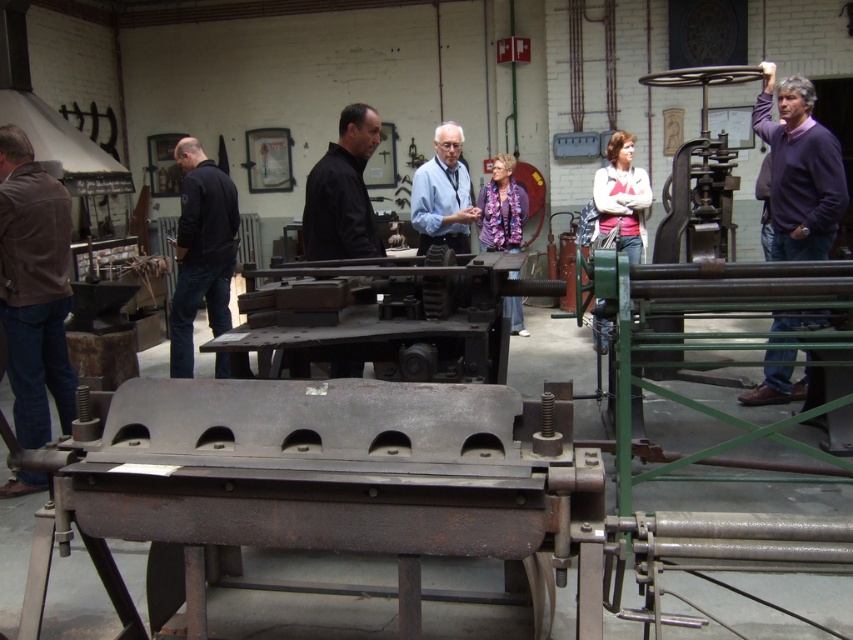
You are standing in the workshop and want to locate the brown leather jacket at left. Which direction should you move relative to the rusty metal machinery at center?

To locate the brown leather jacket at left, you should move to the left of the rusty metal machinery at center since the brown leather jacket at left is positioned to the left of the rusty metal machinery at center.

You are standing in the workshop and want to locate the rusty metal machinery at center. According to the coordinates provided, where exactly should you look?

The rusty metal machinery at center is located at coordinates point (387, 316).